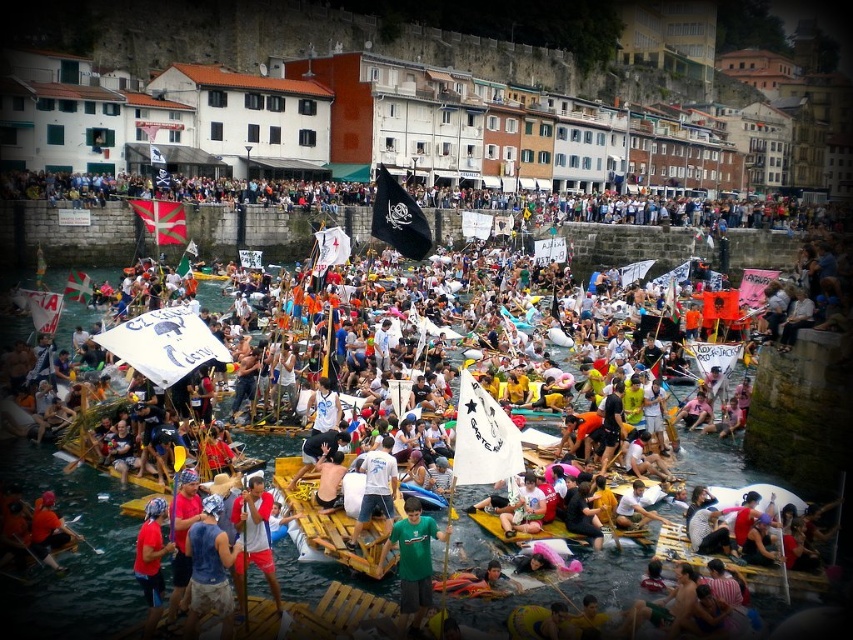
Question: In this image, where is red fabric headscarf at lower left located relative to white cotton t-shirt at center?

Choices:
 (A) below
 (B) above

Answer: (B)

Question: Does blue fabric shirt at center appear on the right side of red fabric headscarf at lower left?

Choices:
 (A) yes
 (B) no

Answer: (A)

Question: Which of the following is the closest to the observer?

Choices:
 (A) (155, 506)
 (B) (195, 554)
 (C) (6, 172)

Answer: (B)

Question: Is blue fabric shirt at center to the left of green fabric shirt at center from the viewer's perspective?

Choices:
 (A) no
 (B) yes

Answer: (B)

Question: Estimate the real-world distances between objects in this image. Which object is farther from the wooden raft at center?

Choices:
 (A) white cotton t-shirt at center
 (B) red fabric shirt at center

Answer: (A)

Question: Which is nearer to the red fabric headscarf at lower left?

Choices:
 (A) green fabric shirt at center
 (B) red fabric shirt at center
 (C) white paper banners at upper center

Answer: (B)